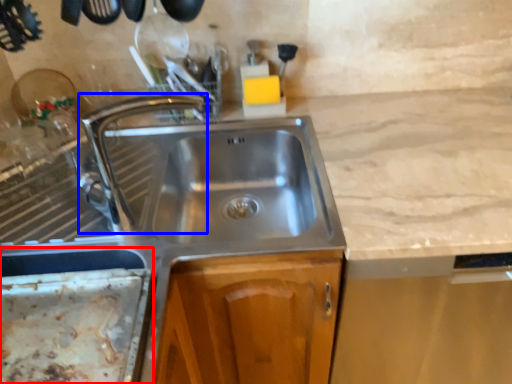
Question: Which object is further to the camera taking this photo, appliance (highlighted by a red box) or tap (highlighted by a blue box)?

Choices:
 (A) appliance
 (B) tap

Answer: (B)